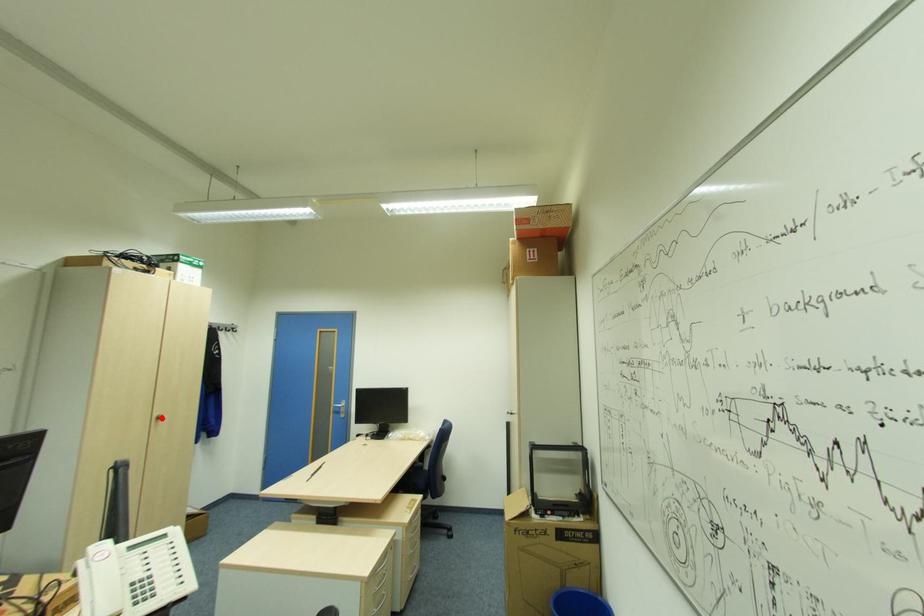
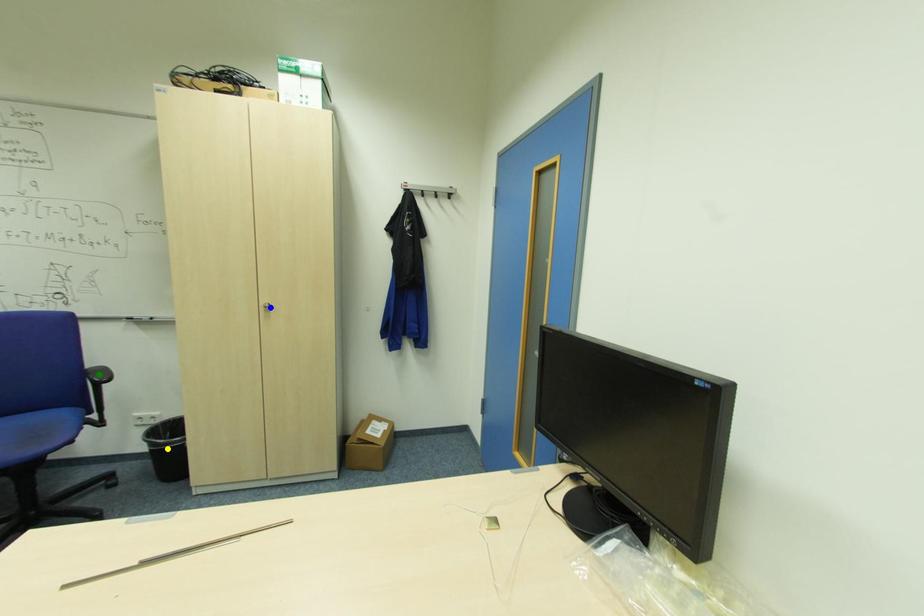
Question: I am providing you with two images of the same scene from different viewpoints. A red point is marked on the first image. You are given multiple points on the second image. Can you choose the point in image 2 that corresponds to the point in image 1?

Choices:
 (A) blue point
 (B) yellow point
 (C) green point

Answer: (A)